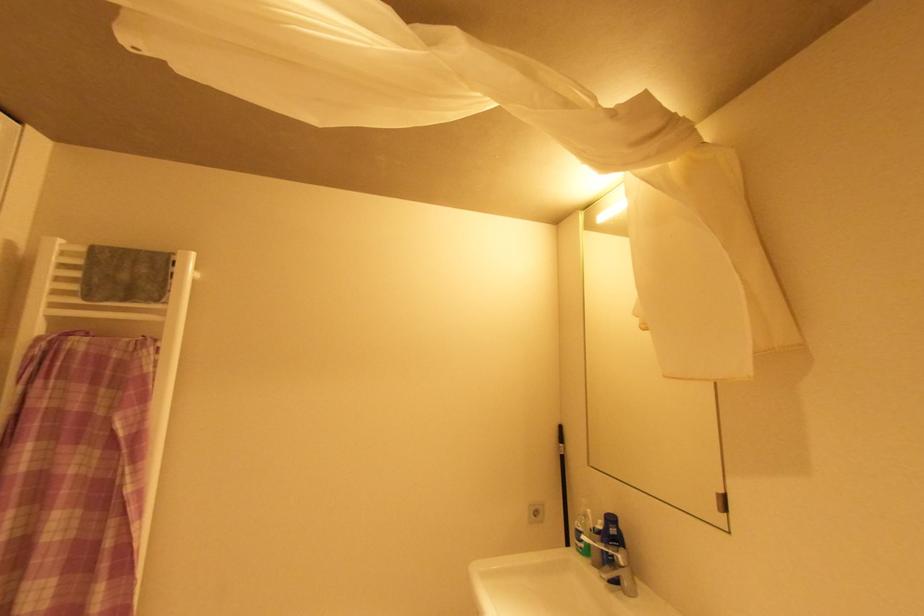
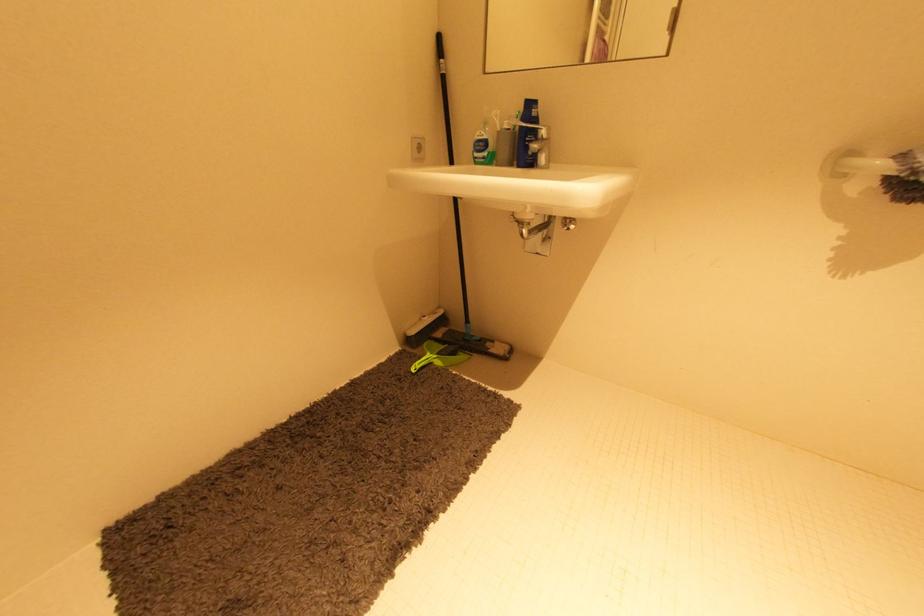
Based on the continuous images, in which direction is the camera rotating?

The rotation direction of the camera is right-down.